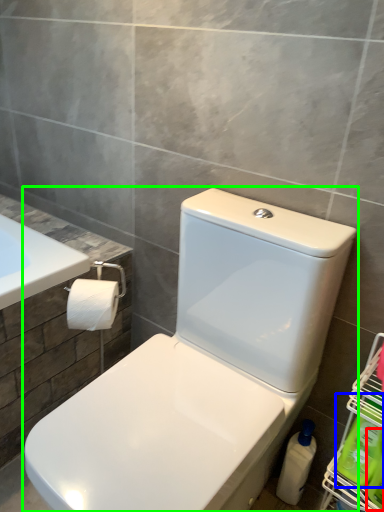
Question: Which object is positioned farthest from cleaning product (highlighted by a red box)? Select from cleaning product (highlighted by a blue box) and toilet (highlighted by a green box).

Choices:
 (A) cleaning product
 (B) toilet

Answer: (B)